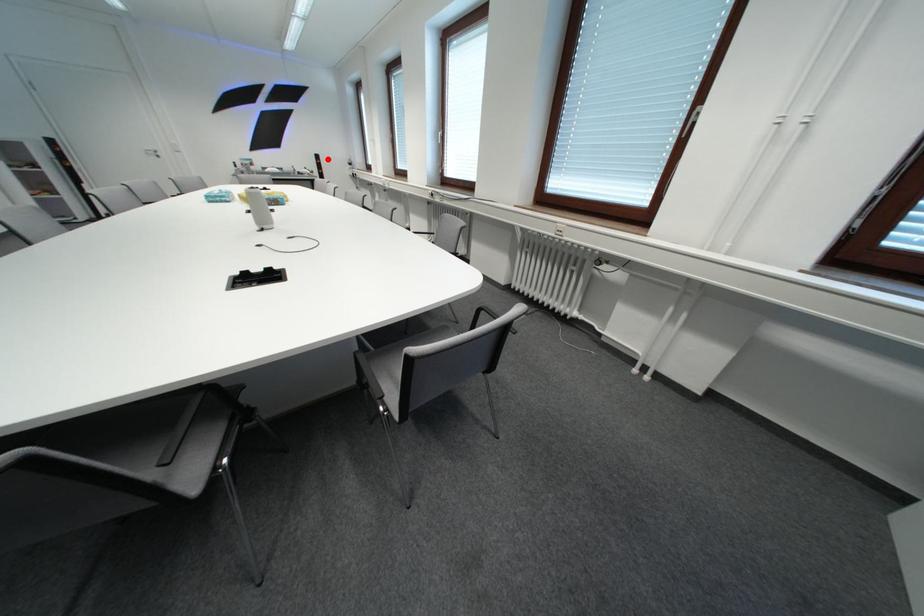
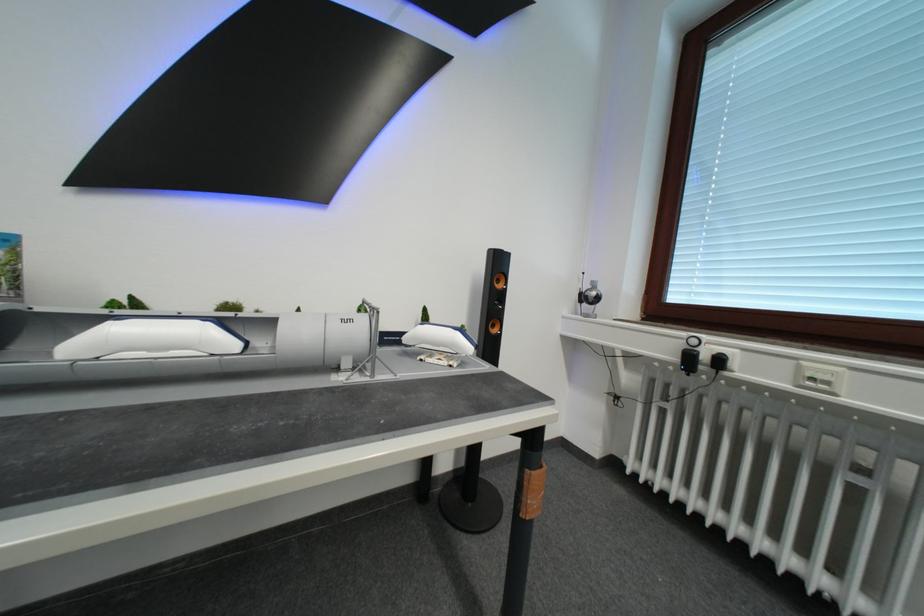
Locate, in the second image, the point that corresponds to the highlighted location in the first image.

(507, 265)